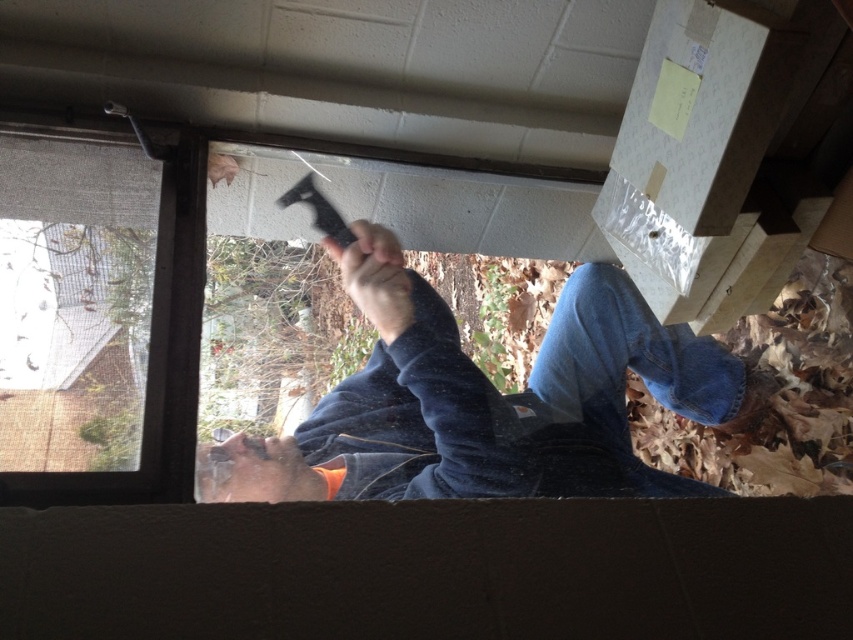
Question: Does orange fabric hand at lower center appear on the right side of matte black tool at center?

Choices:
 (A) no
 (B) yes

Answer: (A)

Question: Considering the real-world distances, which object is closest to the dark blue fleece at center?

Choices:
 (A) clear glass window at center
 (B) orange fabric hand at lower center
 (C) matte black tool at center

Answer: (B)

Question: Does dark blue fleece at center have a greater width compared to orange fabric hand at lower center?

Choices:
 (A) no
 (B) yes

Answer: (B)

Question: Among these points, which one is farthest from the camera?

Choices:
 (A) (440, 465)
 (B) (230, 500)
 (C) (189, 227)
 (D) (393, 320)

Answer: (D)

Question: Is orange fabric hand at lower center in front of matte black tool at center?

Choices:
 (A) yes
 (B) no

Answer: (A)

Question: Which object appears closest to the camera in this image?

Choices:
 (A) dark blue fleece at center
 (B) matte black tool at center
 (C) orange fabric hand at lower center

Answer: (C)